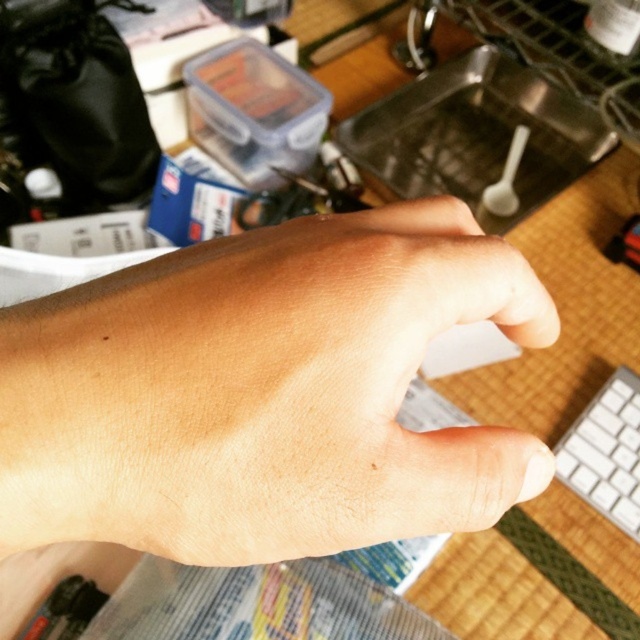
You are a robotic arm trying to place an object on the desk. The skinsmoothhand at center is currently blocking the area at point 0.614, 0.412. Can you place your object there without touching the hand?

The skinsmoothhand at center is positioned exactly at point (262, 392), so placing an object there would require touching the hand. Therefore, you cannot place your object there without touching the hand.

You are trying to reach for the white plastic keyboard at lower right from your current position near the skinsmoothhand at center. Based on the scene, will your hand need to move forward or backward to reach it?

The skinsmoothhand at center is closer to the viewer than the white plastic keyboard at lower right, so you would need to move your hand backward to reach the white plastic keyboard at lower right.